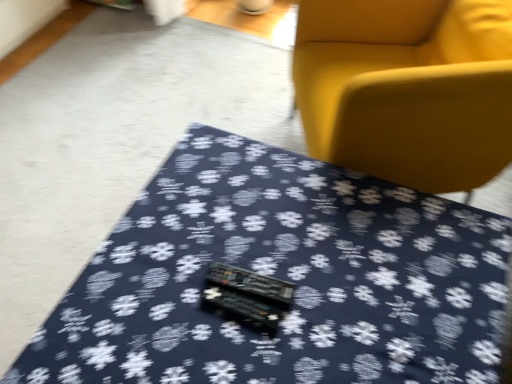
Question: From a real-world perspective, is dark blue fabric at center located higher than matte yellow armchair at upper right?

Choices:
 (A) yes
 (B) no

Answer: (B)

Question: From the image's perspective, is dark blue fabric at center located above matte yellow armchair at upper right?

Choices:
 (A) no
 (B) yes

Answer: (A)

Question: Can you confirm if dark blue fabric at center is shorter than matte yellow armchair at upper right?

Choices:
 (A) no
 (B) yes

Answer: (B)

Question: Considering the relative sizes of dark blue fabric at center and matte yellow armchair at upper right in the image provided, is dark blue fabric at center wider than matte yellow armchair at upper right?

Choices:
 (A) no
 (B) yes

Answer: (B)

Question: Is dark blue fabric at center oriented away from matte yellow armchair at upper right?

Choices:
 (A) yes
 (B) no

Answer: (B)

Question: From the image's perspective, is dark blue fabric at center under matte yellow armchair at upper right?

Choices:
 (A) no
 (B) yes

Answer: (B)

Question: Does matte yellow armchair at upper right have a larger size compared to dark blue fabric at center?

Choices:
 (A) no
 (B) yes

Answer: (B)

Question: Is dark blue fabric at center at the back of matte yellow armchair at upper right?

Choices:
 (A) yes
 (B) no

Answer: (B)

Question: Is matte yellow armchair at upper right next to dark blue fabric at center and touching it?

Choices:
 (A) yes
 (B) no

Answer: (B)

Question: Would you say matte yellow armchair at upper right contains dark blue fabric at center?

Choices:
 (A) no
 (B) yes

Answer: (A)

Question: Can you confirm if matte yellow armchair at upper right is taller than dark blue fabric at center?

Choices:
 (A) no
 (B) yes

Answer: (B)

Question: Considering the relative positions of matte yellow armchair at upper right and dark blue fabric at center in the image provided, is matte yellow armchair at upper right to the left of dark blue fabric at center from the viewer's perspective?

Choices:
 (A) no
 (B) yes

Answer: (A)

Question: Is dark blue fabric at center in front of or behind matte yellow armchair at upper right in the image?

Choices:
 (A) behind
 (B) front

Answer: (B)